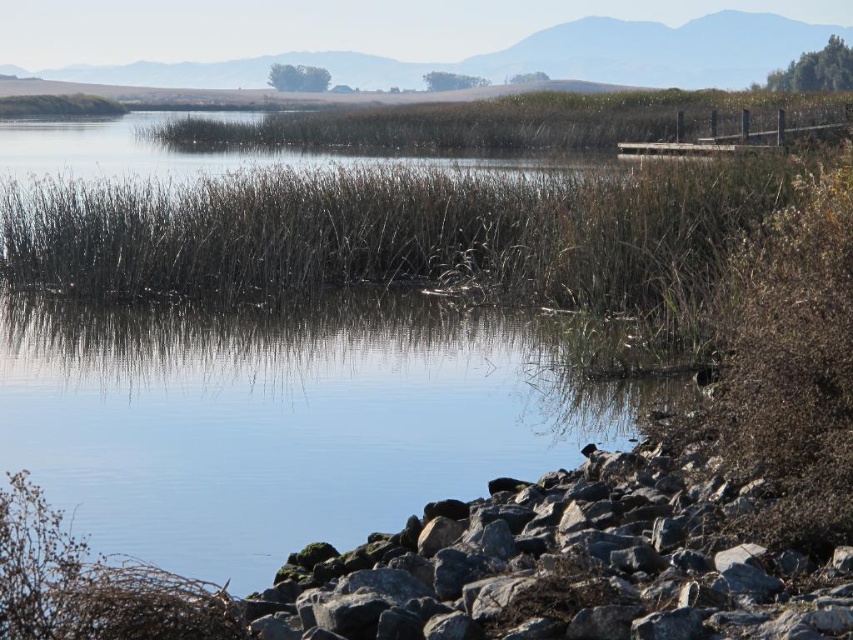
Question: Is clear water at lower left above brown dry grass at lower left?

Choices:
 (A) no
 (B) yes

Answer: (B)

Question: Is clear water at lower left wider than gray rock at lower right?

Choices:
 (A) no
 (B) yes

Answer: (B)

Question: Which of the following is the closest to the observer?

Choices:
 (A) gray rock at lower right
 (B) clear water at lower left
 (C) brown dry grass at lower left

Answer: (C)

Question: Which of the following is the farthest from the observer?

Choices:
 (A) (543, 614)
 (B) (61, 518)

Answer: (A)

Question: Is clear water at lower left positioned before brown dry grass at lower left?

Choices:
 (A) no
 (B) yes

Answer: (A)

Question: Considering the real-world distances, which object is closest to the gray rock at lower right?

Choices:
 (A) clear water at lower left
 (B) brown dry grass at lower left

Answer: (B)